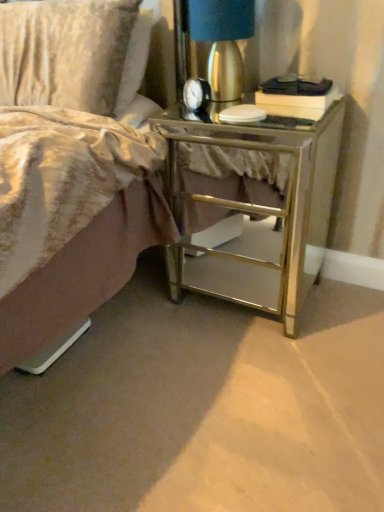
Question: Considering the positions of velvety gold pillow at upper left and metallic gold lamp at upper right in the image, is velvety gold pillow at upper left wider or thinner than metallic gold lamp at upper right?

Choices:
 (A) wide
 (B) thin

Answer: (A)

Question: Is point (109, 82) positioned closer to the camera than point (205, 0)?

Choices:
 (A) farther
 (B) closer

Answer: (A)

Question: Considering the real-world distances, which object is closest to the mirrored glass nightstand at lower right?

Choices:
 (A) velvety gold pillow at upper left
 (B) metallic gold lamp at upper right

Answer: (B)

Question: Which object is the farthest from the mirrored glass nightstand at lower right?

Choices:
 (A) velvety gold pillow at upper left
 (B) metallic gold lamp at upper right

Answer: (A)